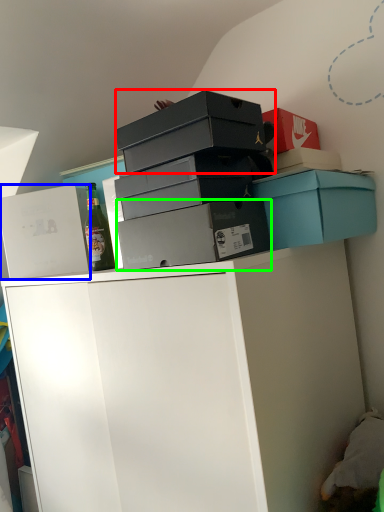
Question: Which object is positioned farthest from box (highlighted by a red box)? Select from box (highlighted by a blue box) and box (highlighted by a green box).

Choices:
 (A) box
 (B) box

Answer: (A)